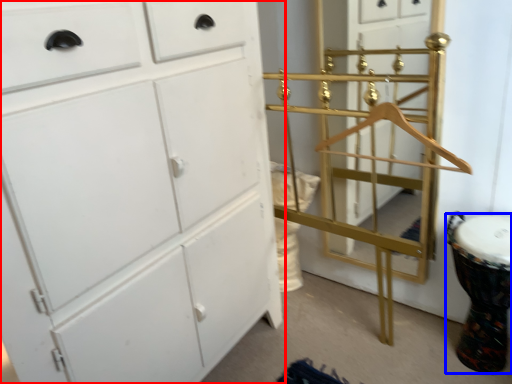
Question: Among these objects, which one is farthest to the camera, chest of drawers (highlighted by a red box) or drum (highlighted by a blue box)?

Choices:
 (A) chest of drawers
 (B) drum

Answer: (B)